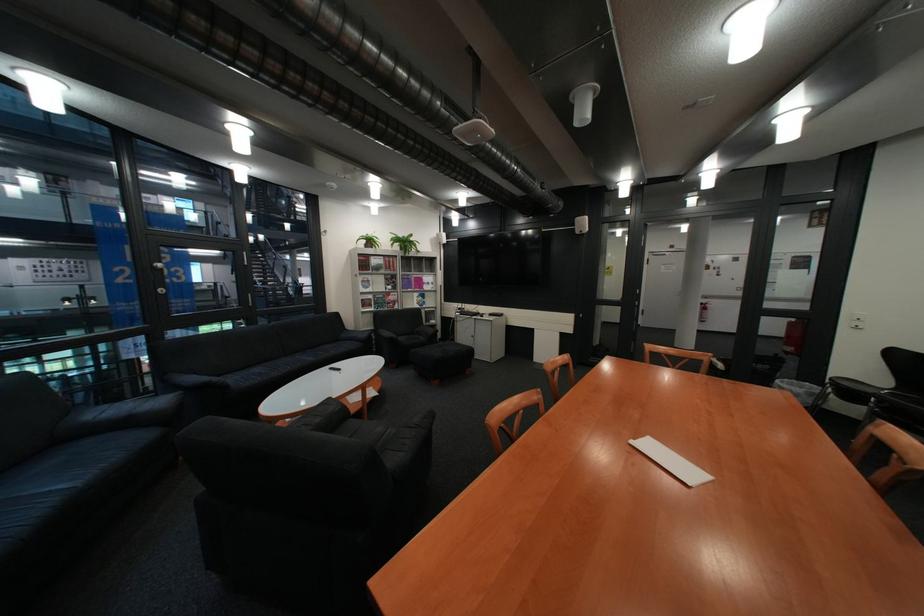
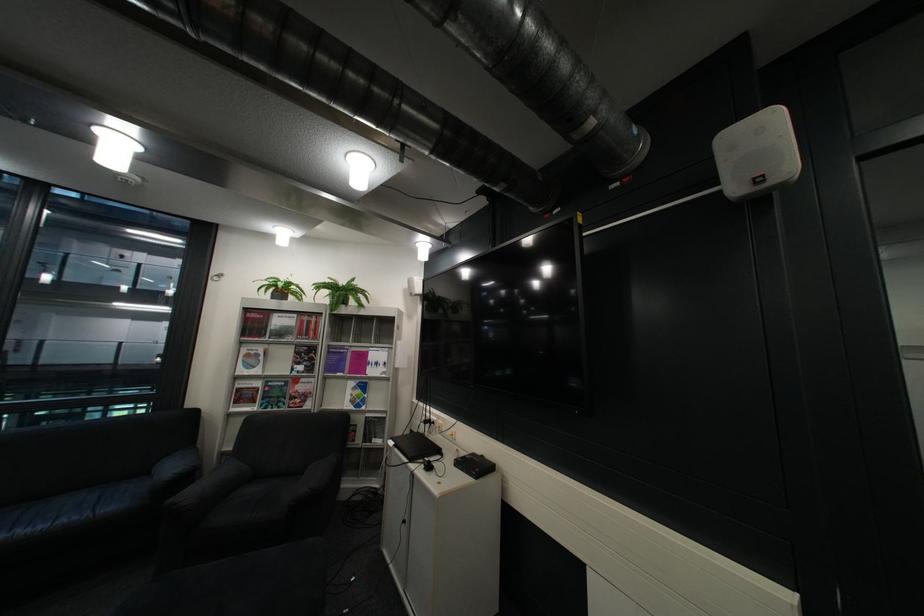
Question: I am providing you with two images of the same scene from different viewpoints. Please identify which objects are invisible in image2.

Choices:
 (A) magazine on shelf
 (B) black laptop
 (C) potted plant
 (D) none of these

Answer: (D)